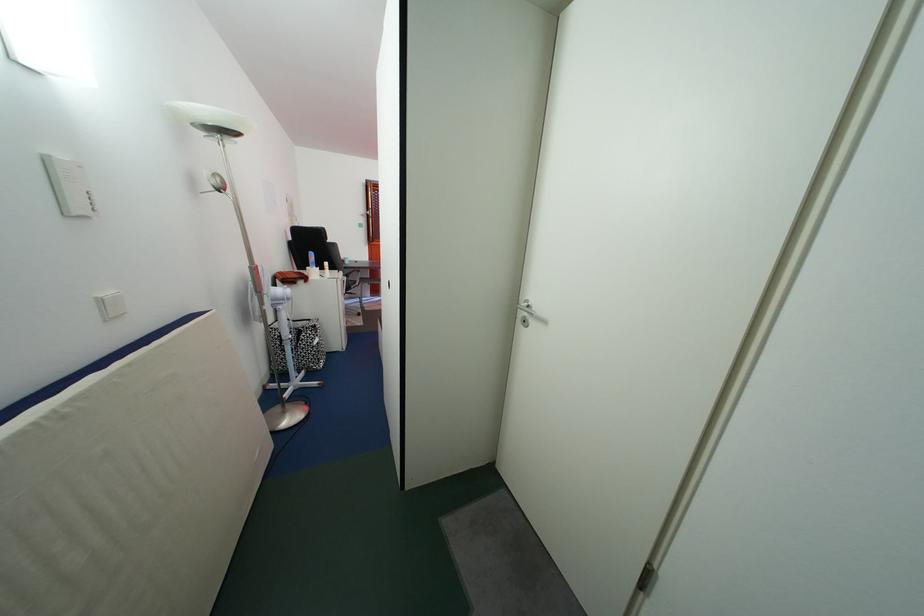
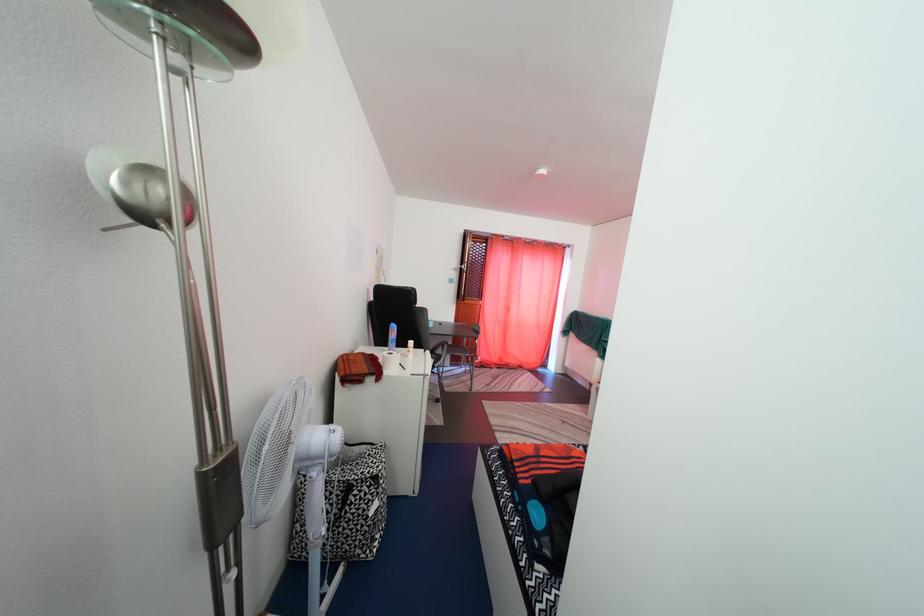
The point at (322, 334) is marked in the first image. Where is the corresponding point in the second image?

(384, 485)